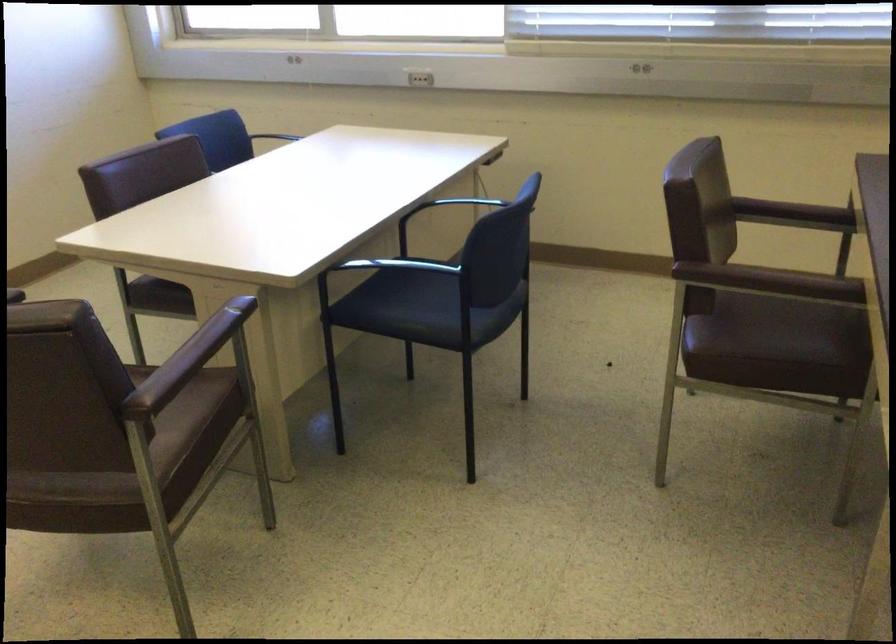
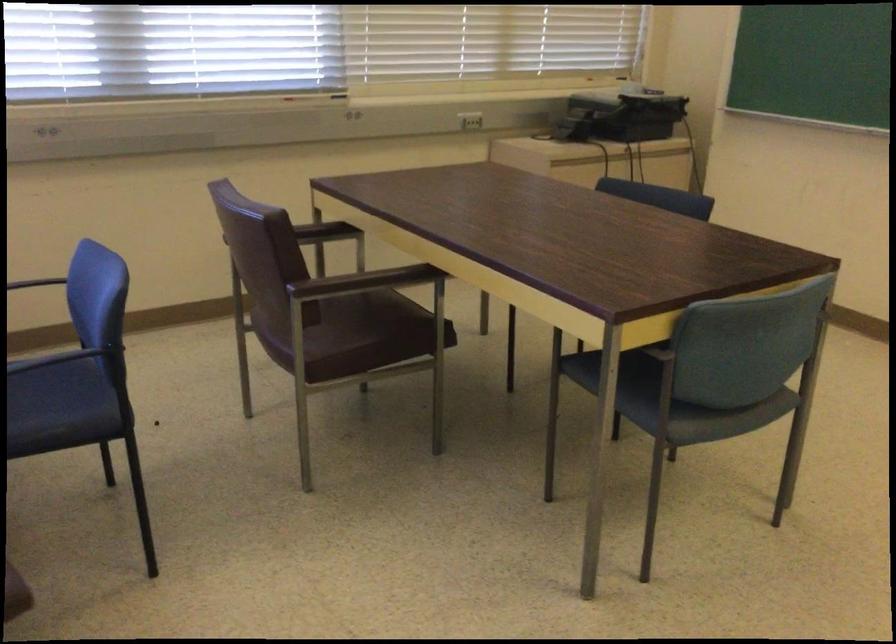
Question: The images are taken continuously from a first-person perspective. In which direction is your viewpoint rotating?

Choices:
 (A) Left
 (B) Right
 (C) Up
 (D) Down

Answer: (B)